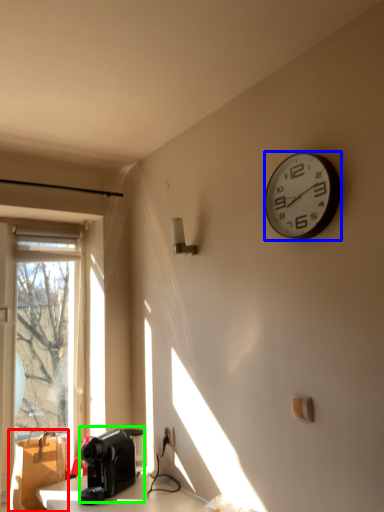
Question: Which is farther away from cardboard box (highlighted by a red box)? wall clock (highlighted by a blue box) or appliance (highlighted by a green box)?

Choices:
 (A) wall clock
 (B) appliance

Answer: (A)